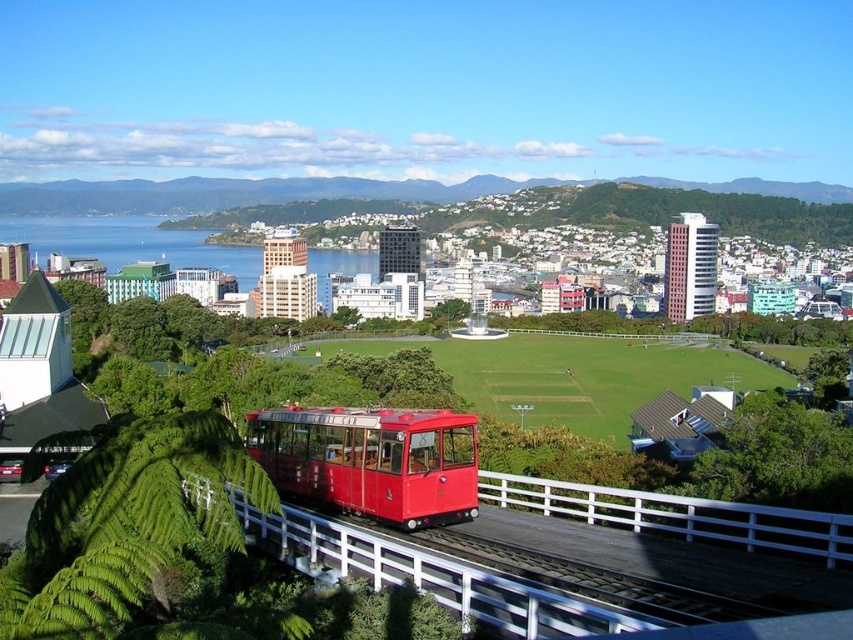
Question: Does matte red tram at center have a lesser width compared to blue water at center?

Choices:
 (A) yes
 (B) no

Answer: (A)

Question: Is matte red tram at center to the right of blue water at center from the viewer's perspective?

Choices:
 (A) yes
 (B) no

Answer: (A)

Question: Among these objects, which one is nearest to the camera?

Choices:
 (A) blue water at center
 (B) matte red tram at center

Answer: (B)

Question: Which point is farther from the camera taking this photo?

Choices:
 (A) (91, 220)
 (B) (416, 506)

Answer: (A)

Question: Is matte red tram at center to the right of blue water at center from the viewer's perspective?

Choices:
 (A) yes
 (B) no

Answer: (A)